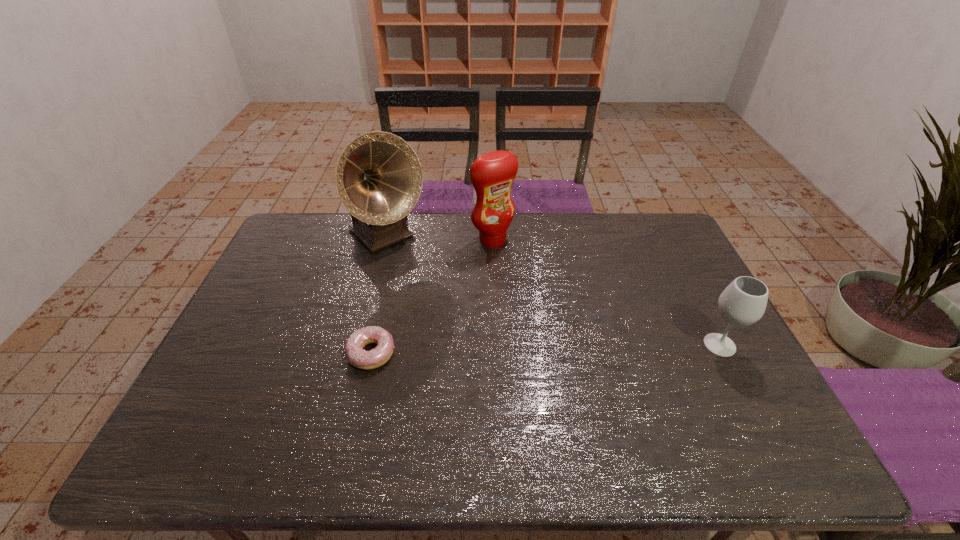
You are a GUI agent. You are given a task and a screenshot of the screen. Output one action in this format:
    pyautogui.click(x=<x>, y=<y>)
    Task: Click on the free space that is in between the tallest object and the wineglass
    
    Given the screenshot: What is the action you would take?
    pyautogui.click(x=553, y=291)

Locate an element on the screen. This screenshot has width=960, height=540. free space that is in between the doughnut and the wineglass is located at coordinates click(x=545, y=349).

Identify the location of free area in between the wineglass and the doughnut. The height and width of the screenshot is (540, 960). (545, 349).

At what (x,y) coordinates should I click in order to perform the action: click on object identified as the second closest to the tallest object. Please return your answer as a coordinate pair (x, y). The image size is (960, 540). Looking at the image, I should click on (360, 358).

At what (x,y) coordinates should I click in order to perform the action: click on object that is the second closest to the third object from left to right. Please return your answer as a coordinate pair (x, y). Looking at the image, I should click on (360, 358).

You are a GUI agent. You are given a task and a screenshot of the screen. Output one action in this format:
    pyautogui.click(x=<x>, y=<y>)
    Task: Click on the free space that satisfies the following two spatial constraints: 1. on the back side of the shortest object; 2. on the left side of the wineglass
    The height and width of the screenshot is (540, 960).
    Given the screenshot: What is the action you would take?
    373,345